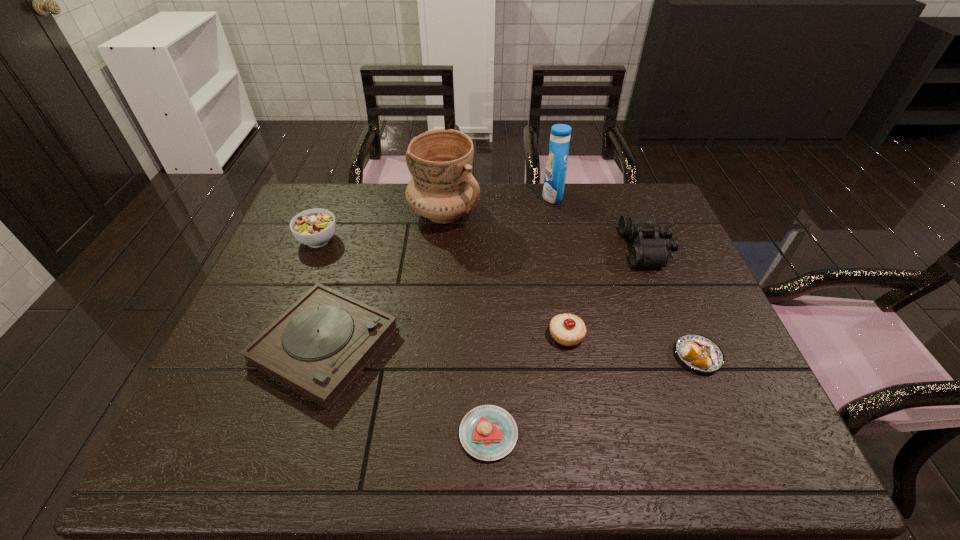
The height and width of the screenshot is (540, 960). In order to click on detergent located at the far edge in this screenshot , I will do `click(555, 174)`.

I want to click on pottery located at the far edge, so click(x=443, y=189).

Find the location of a particular element. object present at the near edge is located at coordinates (487, 432).

Identify the location of soup bowl that is at the left edge. The image size is (960, 540). (315, 227).

This screenshot has height=540, width=960. Identify the location of phonograph record present at the left edge. (318, 347).

I want to click on binoculars that is positioned at the right edge, so click(650, 249).

The image size is (960, 540). I want to click on pastry at the right edge, so pyautogui.click(x=697, y=352).

Locate an element on the screen. This screenshot has height=540, width=960. free point at the far edge is located at coordinates (379, 226).

Image resolution: width=960 pixels, height=540 pixels. In the image, there is a desktop. What are the coordinates of `free space at the left edge` in the screenshot? It's located at (216, 414).

Locate an element on the screen. This screenshot has width=960, height=540. vacant area at the right edge of the desktop is located at coordinates (682, 322).